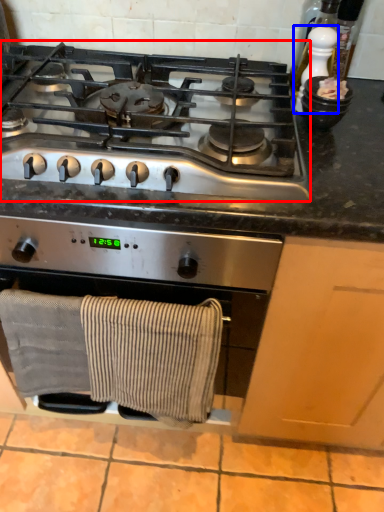
Question: Among these objects, which one is farthest to the camera, gas stove (highlighted by a red box) or appliance (highlighted by a blue box)?

Choices:
 (A) gas stove
 (B) appliance

Answer: (B)